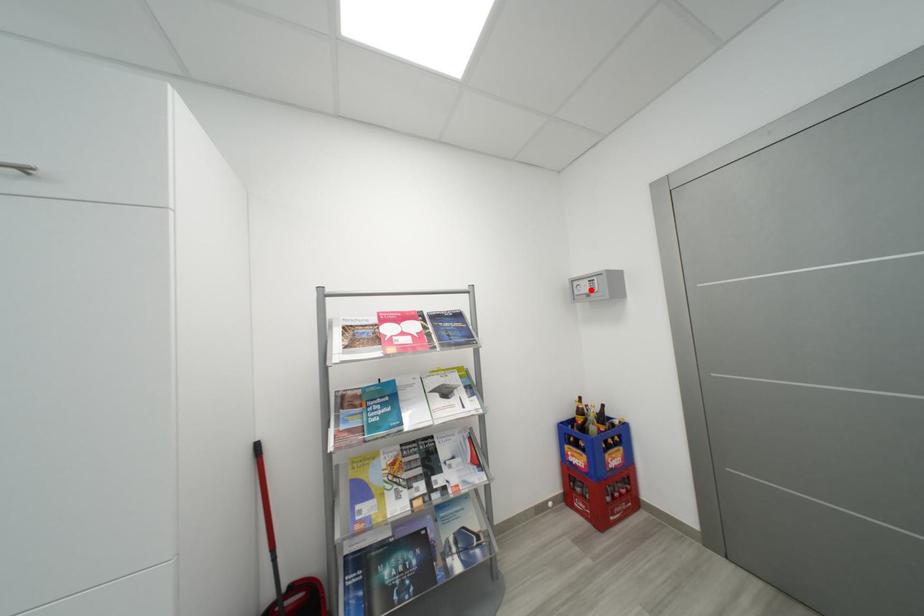
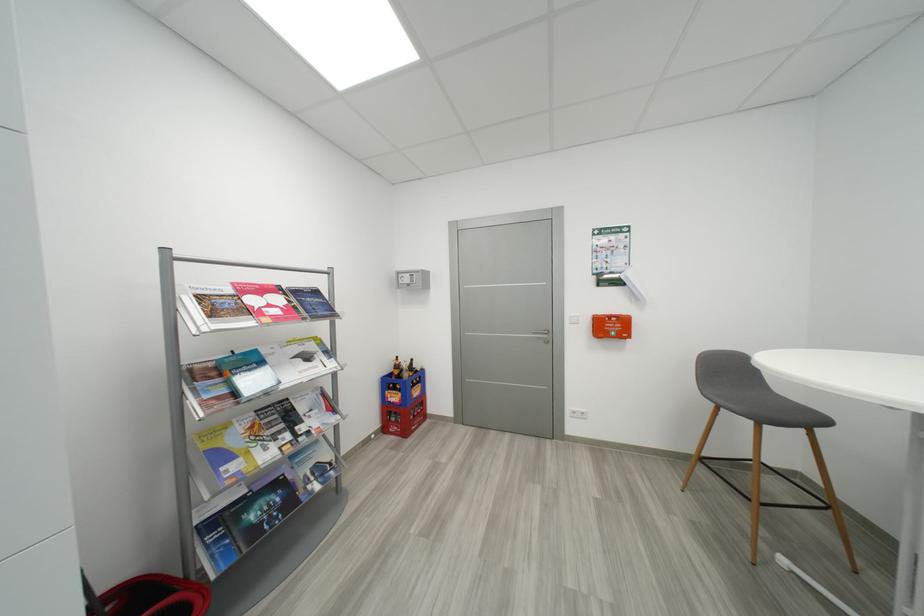
In the second image, find the point that corresponds to the highlighted location in the first image.

(412, 282)